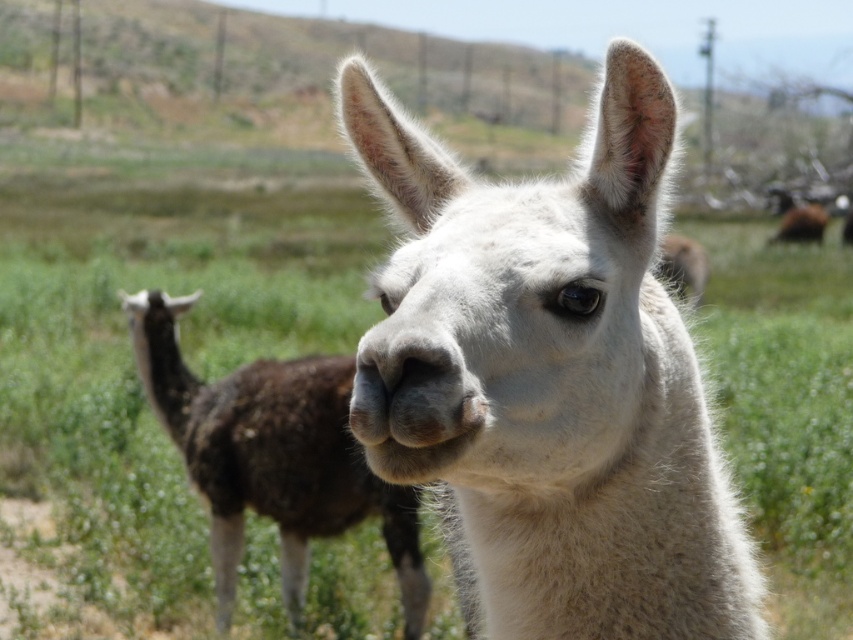
Between white woolen alpaca at center and fuzzy brown alpaca at center, which one has more height?

With more height is fuzzy brown alpaca at center.

Is white woolen alpaca at center shorter than fuzzy brown alpaca at center?

Indeed, white woolen alpaca at center has a lesser height compared to fuzzy brown alpaca at center.

Who is more distant from viewer, (428, 408) or (144, 384)?

Point (144, 384)

Locate an element on the screen. The width and height of the screenshot is (853, 640). white woolen alpaca at center is located at coordinates (550, 378).